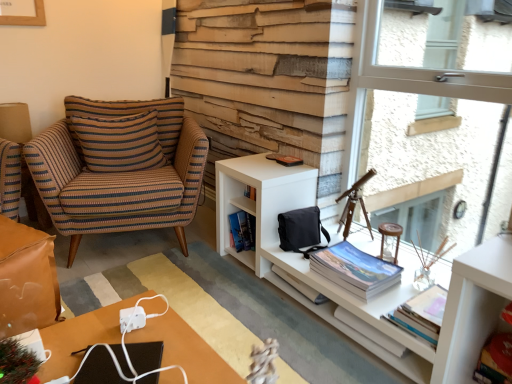
Find the location of a particular element. The image size is (512, 384). vacant space positioned to the left of white matte cabinet at right is located at coordinates (223, 305).